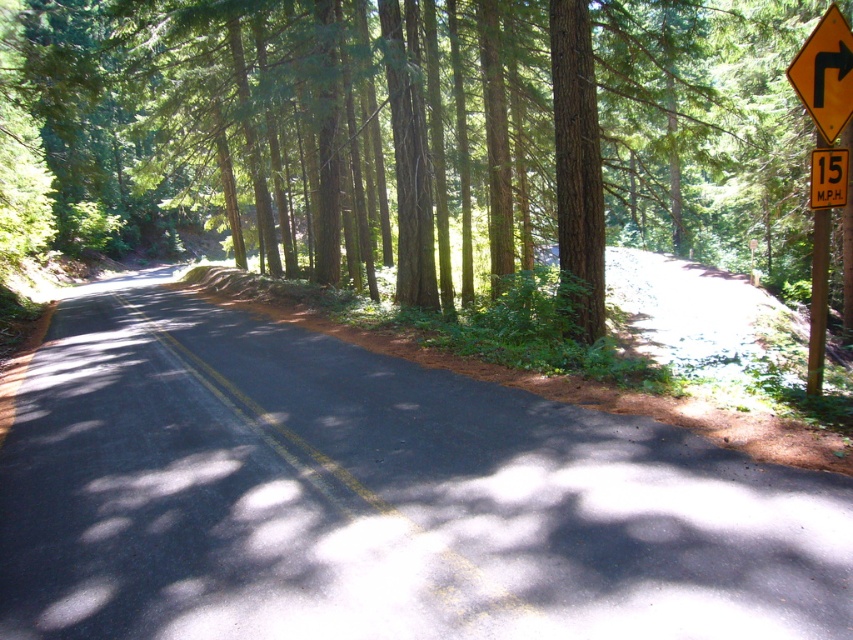
Is brown rough bark tree at center smaller than yellow reflective plastic at right?

Incorrect, brown rough bark tree at center is not smaller in size than yellow reflective plastic at right.

From the picture: Does brown rough bark tree at center come behind yellow reflective plastic at right?

Yes, it is behind yellow reflective plastic at right.

Find the location of a particular element. brown rough bark tree at center is located at coordinates (577, 160).

Locate an element on the screen. This screenshot has width=853, height=640. brown rough bark tree at center is located at coordinates (577, 160).

Who is more distant from viewer, (558, 97) or (825, 99)?

Point (558, 97)

Is brown rough bark tree at center wider than yellow/yellowish wood sign at right?

Yes.

This screenshot has width=853, height=640. Find the location of `brown rough bark tree at center`. brown rough bark tree at center is located at coordinates (577, 160).

Is yellow signpost at right to the right of yellow plastic sign at upper right from the viewer's perspective?

Indeed, yellow signpost at right is positioned on the right side of yellow plastic sign at upper right.

Looking at this image, can you confirm if yellow signpost at right is positioned below yellow plastic sign at upper right?

Answer: Yes.

What do you see at coordinates (817, 300) in the screenshot?
I see `yellow signpost at right` at bounding box center [817, 300].

Where is `yellow signpost at right`? This screenshot has height=640, width=853. yellow signpost at right is located at coordinates (817, 300).